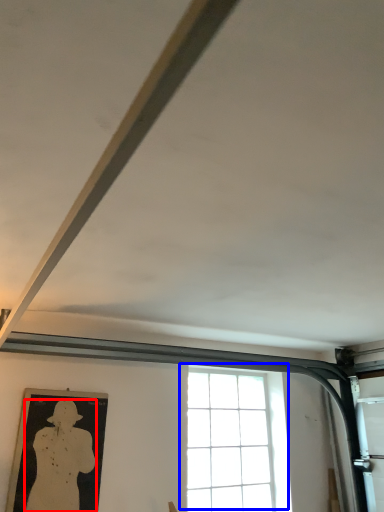
Question: Which object appears closest to the camera in this image, person (highlighted by a red box) or window (highlighted by a blue box)?

Choices:
 (A) person
 (B) window

Answer: (A)